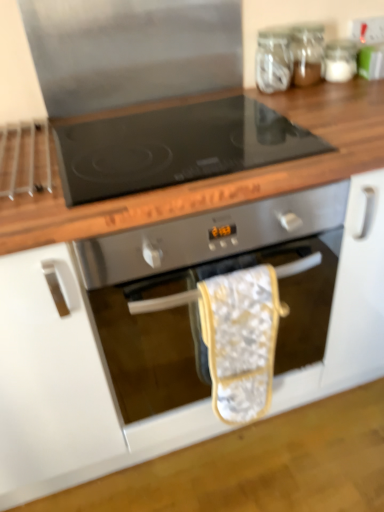
Identify the location of space that is in front of transparent glass jar at upper right, which appears as the second glass jar when viewed from the right. The width and height of the screenshot is (384, 512). (320, 97).